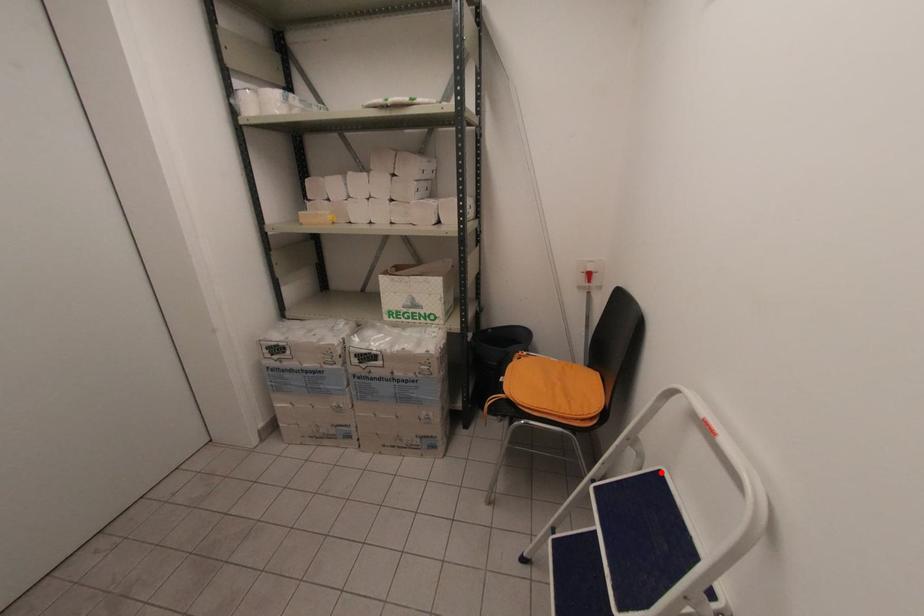
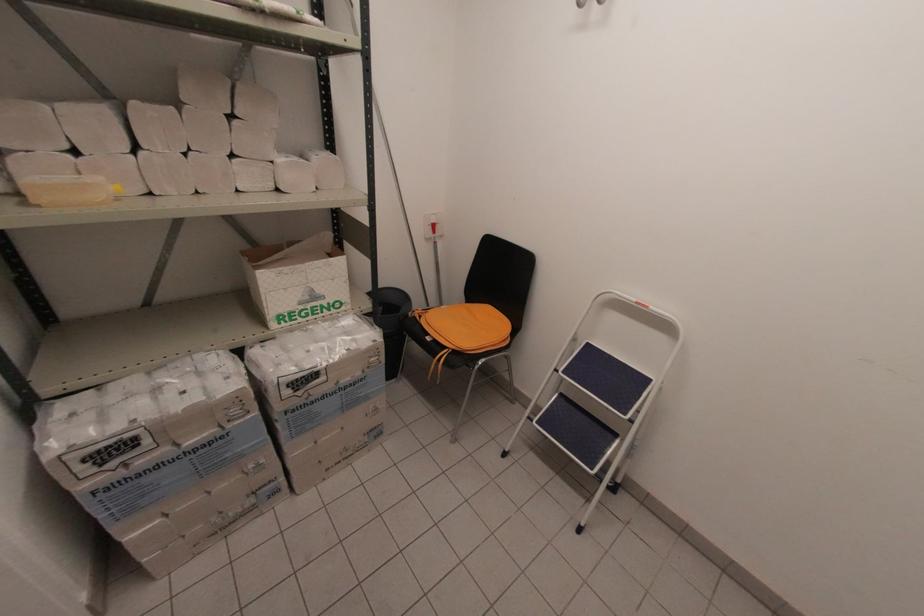
Locate, in the second image, the point that corresponds to the highlighted location in the first image.

(589, 344)